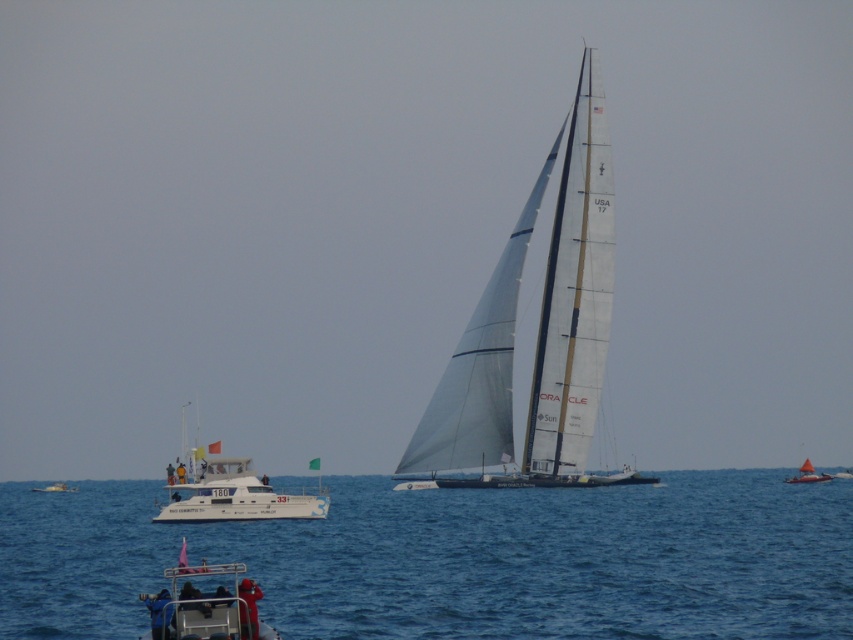
Question: Which object appears closest to the camera in this image?

Choices:
 (A) metallic gray boat at lower left
 (B) white matte sailboat at center
 (C) white matte yacht at lower left

Answer: (A)

Question: Which of the following is the farthest from the observer?

Choices:
 (A) white matte yacht at lower left
 (B) bright orange sailboat at right

Answer: (B)

Question: In this image, where is blue water at center located relative to metallic gray boat at lower left?

Choices:
 (A) above
 (B) below

Answer: (A)

Question: Can you confirm if white matte yacht at lower left is positioned above bright orange sailboat at right?

Choices:
 (A) no
 (B) yes

Answer: (B)

Question: Can you confirm if white matte yacht at lower left is positioned to the left of metallic gray boat at lower left?

Choices:
 (A) no
 (B) yes

Answer: (B)

Question: Which of these objects is positioned farthest from the white plastic boat at lower left?

Choices:
 (A) bright orange sailboat at right
 (B) white matte yacht at lower left

Answer: (A)